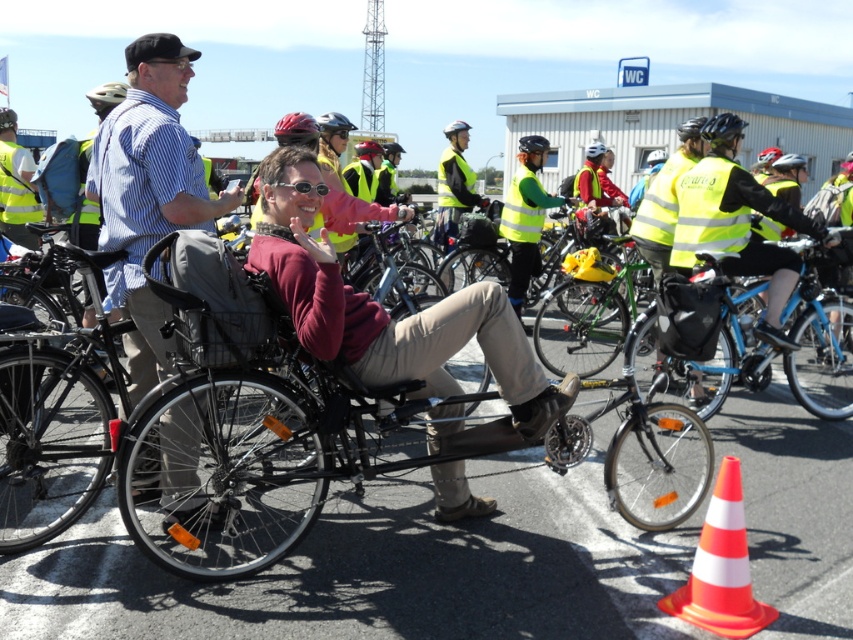
Question: Among these points, which one is farthest from the camera?

Choices:
 (A) (306, 189)
 (B) (698, 618)
 (C) (184, 444)

Answer: (C)

Question: Which object is positioned farthest from the yellow reflective safety vest at upper left?

Choices:
 (A) blue metallic bicycle at center-right
 (B) orange/white plastic traffic cone at lower right
 (C) blue striped shirt at center
 (D) black matte bicycle at center

Answer: (B)

Question: Is black matte bicycle at center positioned before clear plastic goggles at center?

Choices:
 (A) yes
 (B) no

Answer: (A)

Question: Does black matte bicycle at center have a greater width compared to clear plastic goggles at center?

Choices:
 (A) yes
 (B) no

Answer: (A)

Question: Among these points, which one is nearest to the camera?

Choices:
 (A) (611, 406)
 (B) (787, 381)
 (C) (209, 227)
 (D) (308, 186)

Answer: (D)

Question: Can you confirm if orange/white plastic traffic cone at lower right is thinner than green reflective safety vest at center?

Choices:
 (A) yes
 (B) no

Answer: (B)